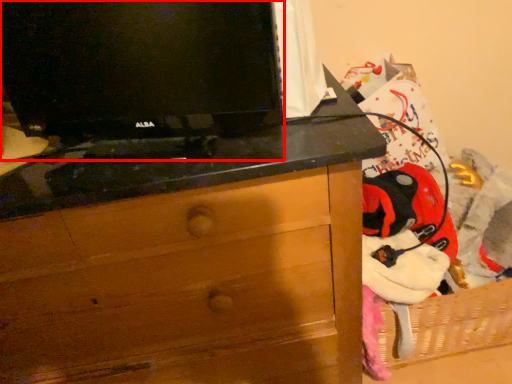
Question: From the image's perspective, where is television (annotated by the red box) located in relation to chest of drawers in the image?

Choices:
 (A) below
 (B) above

Answer: (B)